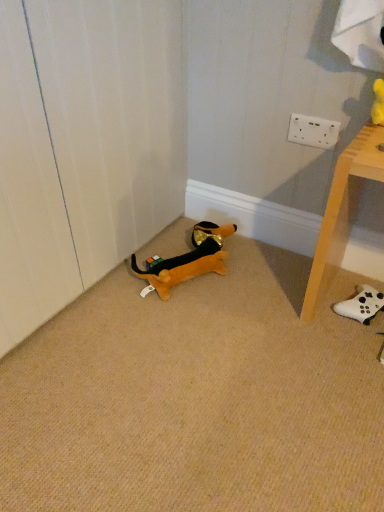
Question: Does white wood table at lower right lie in front of soft plush dog at lower left, the 1th toy in the left-to-right sequence?

Choices:
 (A) yes
 (B) no

Answer: (A)

Question: From a real-world perspective, is white wood table at lower right located higher than soft plush dog at lower left, which is the second toy from right to left?

Choices:
 (A) no
 (B) yes

Answer: (B)

Question: Would you say white wood table at lower right is a long distance from soft plush dog at lower left, which is the second toy from right to left?

Choices:
 (A) yes
 (B) no

Answer: (B)

Question: From the image's perspective, is white wood table at lower right under soft plush dog at lower left, which is the second toy from right to left?

Choices:
 (A) no
 (B) yes

Answer: (A)

Question: From the image's perspective, is white wood table at lower right on soft plush dog at lower left, the 1th toy in the left-to-right sequence?

Choices:
 (A) no
 (B) yes

Answer: (B)

Question: Does point (344, 158) appear closer or farther from the camera than point (198, 224)?

Choices:
 (A) farther
 (B) closer

Answer: (B)

Question: From their relative heights in the image, would you say white wood table at lower right is taller or shorter than soft plush dog at lower left, which is the second toy from right to left?

Choices:
 (A) short
 (B) tall

Answer: (B)

Question: From a real-world perspective, relative to soft plush dog at lower left, which is the second toy from right to left, is white wood table at lower right vertically above or below?

Choices:
 (A) above
 (B) below

Answer: (A)

Question: Based on their positions, is white wood table at lower right located to the left or right of soft plush dog at lower left, the 1th toy in the left-to-right sequence?

Choices:
 (A) right
 (B) left

Answer: (A)

Question: Is soft plush dog at lower left, the 1th toy in the left-to-right sequence, wider or thinner than white matte controller at lower right, which appears as the 1th toy when viewed from the right?

Choices:
 (A) wide
 (B) thin

Answer: (A)

Question: Is point (142, 275) closer or farther from the camera than point (365, 305)?

Choices:
 (A) closer
 (B) farther

Answer: (B)

Question: Would you say soft plush dog at lower left, the 1th toy in the left-to-right sequence, is to the left or to the right of white matte controller at lower right, the 2th toy viewed from the left, in the picture?

Choices:
 (A) left
 (B) right

Answer: (A)

Question: Relative to white matte controller at lower right, the 2th toy viewed from the left, is soft plush dog at lower left, the 1th toy in the left-to-right sequence, in front or behind?

Choices:
 (A) behind
 (B) front

Answer: (A)

Question: Is point (134, 265) closer or farther from the camera than point (354, 195)?

Choices:
 (A) farther
 (B) closer

Answer: (A)

Question: Based on their sizes in the image, would you say soft plush dog at lower left, the 1th toy in the left-to-right sequence, is bigger or smaller than white wood table at lower right?

Choices:
 (A) big
 (B) small

Answer: (B)